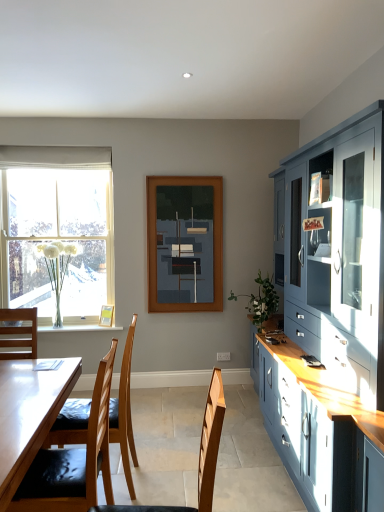
Question: Considering the relative sizes of white glass vase at left, the 2th plant when ordered from front to back, and matte wooden frame at center in the image provided, is white glass vase at left, the 2th plant when ordered from front to back, shorter than matte wooden frame at center?

Choices:
 (A) yes
 (B) no

Answer: (A)

Question: Would you consider white glass vase at left, which is the second plant from right to left, to be distant from matte wooden frame at center?

Choices:
 (A) no
 (B) yes

Answer: (B)

Question: Is white glass vase at left, which is the second plant from right to left, beside matte wooden frame at center?

Choices:
 (A) yes
 (B) no

Answer: (B)

Question: Is white glass vase at left, the first plant in the back-to-front sequence, completely or partially outside of matte wooden frame at center?

Choices:
 (A) no
 (B) yes

Answer: (B)

Question: Is white glass vase at left, which is the 1th plant from left to right, at the right side of matte wooden frame at center?

Choices:
 (A) yes
 (B) no

Answer: (B)

Question: Can you confirm if white glass vase at left, the 2th plant when ordered from front to back, is positioned to the left of matte wooden frame at center?

Choices:
 (A) no
 (B) yes

Answer: (B)

Question: Can you confirm if wooden chair at center, which is counted as the third chair, starting from the back, is bigger than white sheer curtain at upper left?

Choices:
 (A) no
 (B) yes

Answer: (B)

Question: Considering the relative sizes of wooden chair at center, the 1th chair viewed from the front, and white sheer curtain at upper left in the image provided, is wooden chair at center, the 1th chair viewed from the front, taller than white sheer curtain at upper left?

Choices:
 (A) yes
 (B) no

Answer: (A)

Question: From a real-world perspective, is wooden chair at center, which is counted as the third chair, starting from the back, on white sheer curtain at upper left?

Choices:
 (A) yes
 (B) no

Answer: (B)

Question: Is wooden chair at center, which is counted as the third chair, starting from the back, positioned far away from white sheer curtain at upper left?

Choices:
 (A) no
 (B) yes

Answer: (B)

Question: Is wooden chair at center, the 1th chair viewed from the front, outside of white sheer curtain at upper left?

Choices:
 (A) yes
 (B) no

Answer: (A)

Question: Considering the relative sizes of wooden chair at center, which is counted as the third chair, starting from the back, and white sheer curtain at upper left in the image provided, is wooden chair at center, which is counted as the third chair, starting from the back, thinner than white sheer curtain at upper left?

Choices:
 (A) yes
 (B) no

Answer: (B)

Question: From the image's perspective, is white sheer curtain at upper left under clear glass vase at lower left?

Choices:
 (A) yes
 (B) no

Answer: (B)